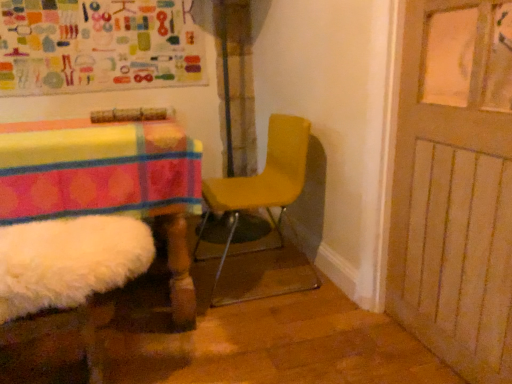
Question: Does wooden door at right have a lesser width compared to yellow matte chair at center?

Choices:
 (A) yes
 (B) no

Answer: (A)

Question: From the image's perspective, is wooden door at right below yellow matte chair at center?

Choices:
 (A) yes
 (B) no

Answer: (B)

Question: Does wooden door at right have a greater height compared to yellow matte chair at center?

Choices:
 (A) yes
 (B) no

Answer: (A)

Question: Does wooden door at right have a larger size compared to yellow matte chair at center?

Choices:
 (A) no
 (B) yes

Answer: (A)

Question: From a real-world perspective, does wooden door at right stand above yellow matte chair at center?

Choices:
 (A) yes
 (B) no

Answer: (A)

Question: Can you confirm if wooden door at right is shorter than yellow matte chair at center?

Choices:
 (A) no
 (B) yes

Answer: (A)

Question: Can you confirm if colorful fabric bulletin board at upper left is positioned to the left of wooden door at right?

Choices:
 (A) yes
 (B) no

Answer: (A)

Question: Does colorful fabric bulletin board at upper left have a greater width compared to wooden door at right?

Choices:
 (A) yes
 (B) no

Answer: (A)

Question: Does colorful fabric bulletin board at upper left have a larger size compared to wooden door at right?

Choices:
 (A) no
 (B) yes

Answer: (B)

Question: Would you say colorful fabric bulletin board at upper left is a long distance from wooden door at right?

Choices:
 (A) yes
 (B) no

Answer: (A)

Question: From the image's perspective, would you say colorful fabric bulletin board at upper left is shown under wooden door at right?

Choices:
 (A) yes
 (B) no

Answer: (B)

Question: Is colorful fabric bulletin board at upper left located outside wooden door at right?

Choices:
 (A) yes
 (B) no

Answer: (A)

Question: Does wooden door at right have a smaller size compared to colorful fabric bulletin board at upper left?

Choices:
 (A) no
 (B) yes

Answer: (B)